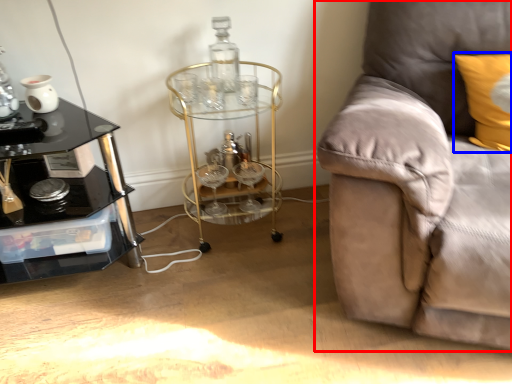
Question: Which object appears closest to the camera in this image, studio couch (highlighted by a red box) or pillow (highlighted by a blue box)?

Choices:
 (A) studio couch
 (B) pillow

Answer: (A)